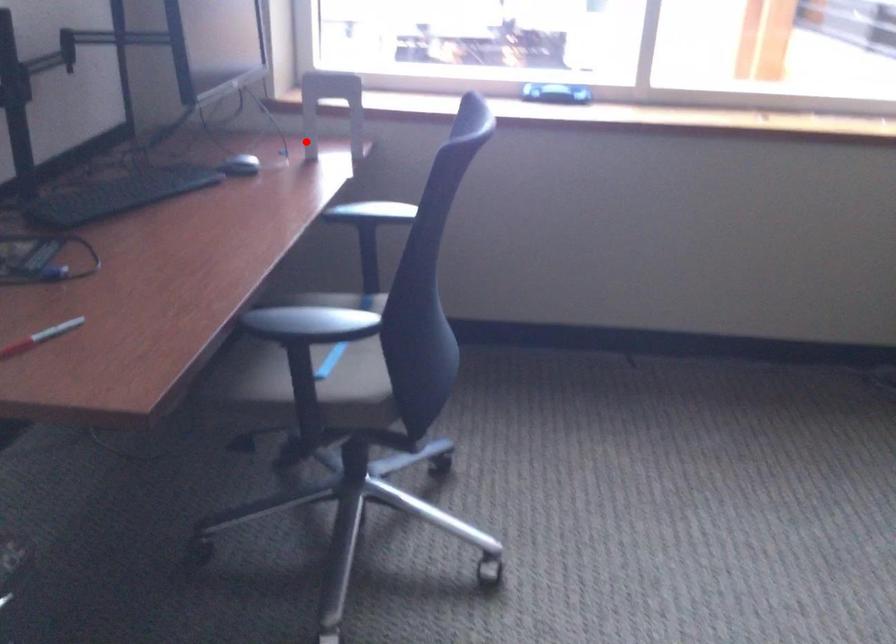
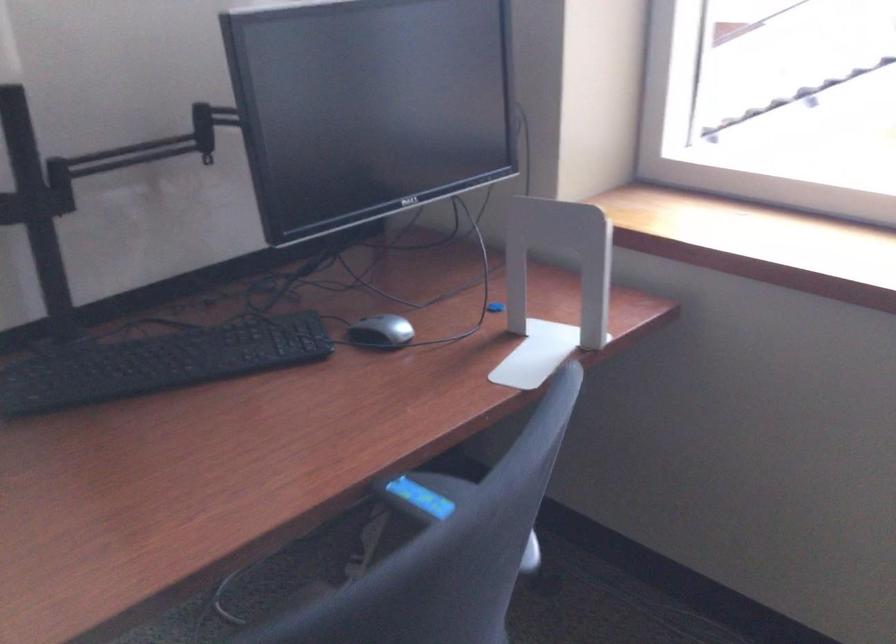
In the second image, find the point that corresponds to the highlighted location in the first image.

(554, 286)